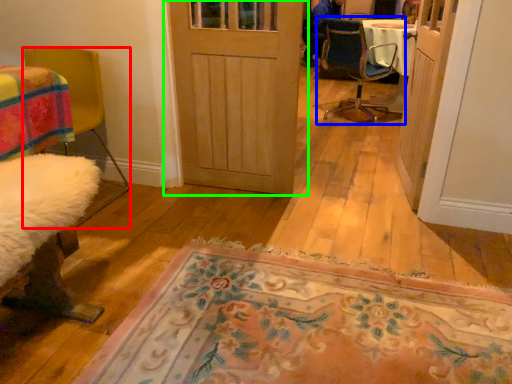
Question: Considering the real-world distances, which object is farthest from chair (highlighted by a red box)? chair (highlighted by a blue box) or door (highlighted by a green box)?

Choices:
 (A) chair
 (B) door

Answer: (A)